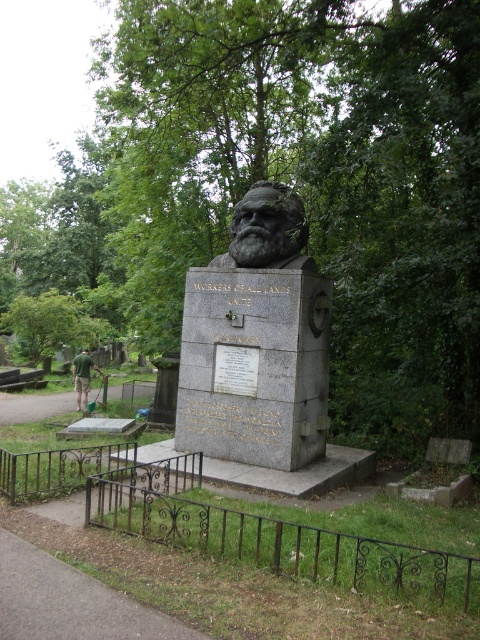
You are a gardener tasked with maintaining the cemetery. You notice both the green leafy tree at upper center and the green grass at lower left need trimming. Which object requires more time to trim based on their sizes?

The green leafy tree at upper center requires more time to trim than the green grass at lower left because it is bigger in size.

From the picture: You are standing in front of the monument and want to place a small bouquet of flowers between the gray stone bust at center and the green stone bust at center. The bouquet requires 30 inches of space. Can you fit it between them?

The gray stone bust at center is 29.13 inches away from the green stone bust at center, which is less than the required 30 inches. Therefore, the bouquet cannot be placed between them.

You are standing in front of the monument and want to place a small flower on the green grass at lower left. Is the gray stone bust at center in your way?

The gray stone bust at center has a greater height compared to green grass at lower left, so the gray stone bust at center may block your path to placing the flower on the green grass at lower left depending on its exact position.